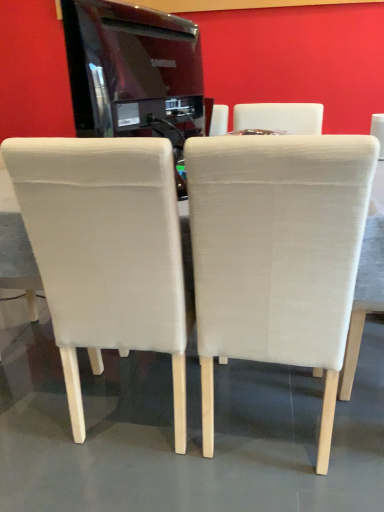
Question: From a real-world perspective, is glossy black tv at upper center under beige fabric chair at center, the 3th chair in the right-to-left sequence?

Choices:
 (A) yes
 (B) no

Answer: (B)

Question: Is glossy black tv at upper center next to beige fabric chair at center, which is the first chair from left to right, and touching it?

Choices:
 (A) yes
 (B) no

Answer: (B)

Question: Is glossy black tv at upper center bigger than beige fabric chair at center, the 3th chair in the right-to-left sequence?

Choices:
 (A) yes
 (B) no

Answer: (B)

Question: From a real-world perspective, is glossy black tv at upper center on top of beige fabric chair at center, which is the first chair from left to right?

Choices:
 (A) no
 (B) yes

Answer: (B)

Question: Are glossy black tv at upper center and beige fabric chair at center, which is the first chair from left to right, far apart?

Choices:
 (A) no
 (B) yes

Answer: (A)

Question: Does glossy black tv at upper center have a greater height compared to beige fabric chair at center, the 3th chair in the right-to-left sequence?

Choices:
 (A) no
 (B) yes

Answer: (A)

Question: Is glossy black tv at upper center directly adjacent to white fabric table at center?

Choices:
 (A) no
 (B) yes

Answer: (A)

Question: From the image's perspective, is glossy black tv at upper center located beneath white fabric table at center?

Choices:
 (A) no
 (B) yes

Answer: (A)

Question: From the image's perspective, is glossy black tv at upper center above white fabric table at center?

Choices:
 (A) no
 (B) yes

Answer: (B)

Question: Is glossy black tv at upper center to the right of white fabric table at center from the viewer's perspective?

Choices:
 (A) no
 (B) yes

Answer: (A)

Question: From a real-world perspective, is glossy black tv at upper center located higher than white fabric table at center?

Choices:
 (A) yes
 (B) no

Answer: (A)

Question: Is glossy black tv at upper center facing towards white fabric table at center?

Choices:
 (A) yes
 (B) no

Answer: (B)

Question: Is beige fabric chair at center, which ranks as the 2th chair in left-to-right order, shorter than white fabric table at center?

Choices:
 (A) yes
 (B) no

Answer: (B)